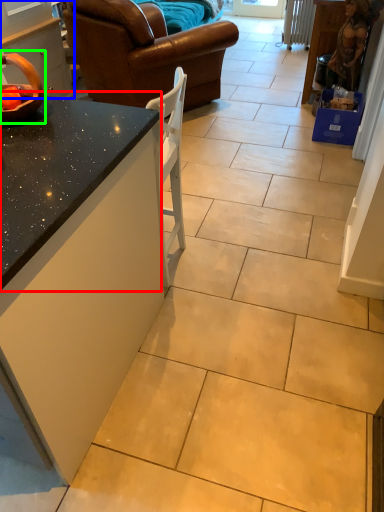
Question: Which object is positioned farthest from countertop (highlighted by a red box)? Select from cabinetry (highlighted by a blue box) and appliance (highlighted by a green box).

Choices:
 (A) cabinetry
 (B) appliance

Answer: (A)